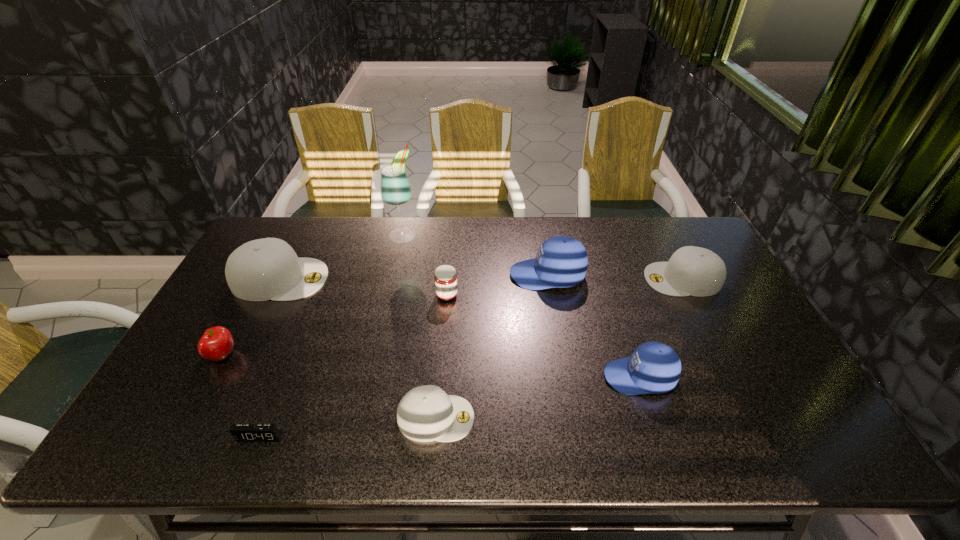
In order to click on vacant area that lies between the nearest gray cap and the farther blue cap in this screenshot , I will do `click(492, 346)`.

Locate an element on the screen. blank region between the alarm clock and the alcohol is located at coordinates (331, 335).

Locate an element on the screen. free space between the nearer blue cap and the farther blue cap is located at coordinates (593, 326).

I want to click on free space between the jam and the farthest object, so click(x=425, y=265).

The height and width of the screenshot is (540, 960). Find the location of `empty location between the apple and the alarm clock`. empty location between the apple and the alarm clock is located at coordinates (242, 396).

Where is `free area in between the second smallest gray cap and the second shortest object`? free area in between the second smallest gray cap and the second shortest object is located at coordinates (560, 348).

In order to click on unoccupied position between the bigger blue cap and the jam in this screenshot , I will do `click(497, 285)`.

This screenshot has height=540, width=960. I want to click on free space between the red jam and the bigger blue cap, so click(x=497, y=285).

Find the location of a particular element. The width and height of the screenshot is (960, 540). the fifth closest object to the second shortest object is located at coordinates (264, 269).

At what (x,y) coordinates should I click in order to perform the action: click on the second closest object relative to the nearer blue cap. Please return your answer as a coordinate pair (x, y). Looking at the image, I should click on (561, 261).